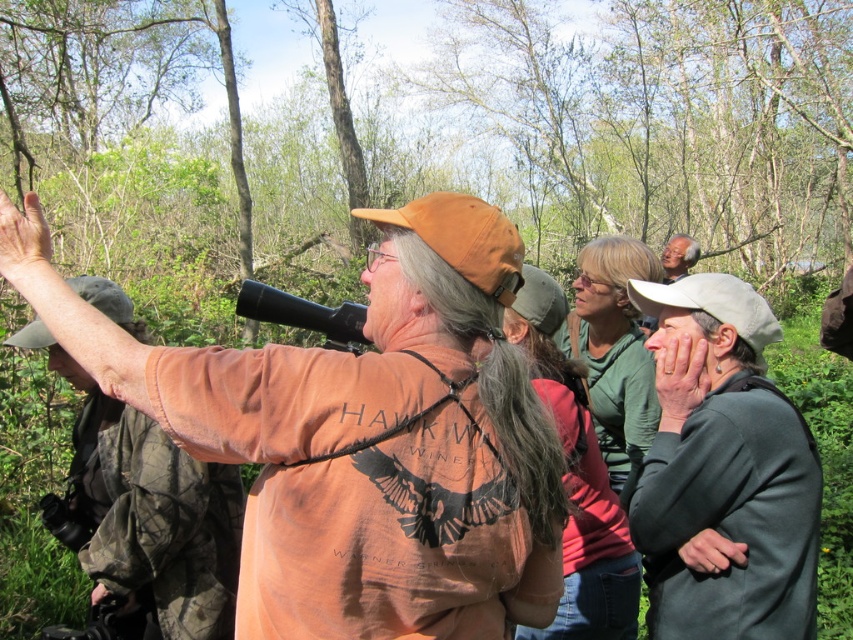
Question: Does orange fabric shirt at center appear on the right side of smooth brown hat at upper right?

Choices:
 (A) no
 (B) yes

Answer: (A)

Question: Is gray fabric jacket at right positioned before orange fabric shirt at upper left?

Choices:
 (A) no
 (B) yes

Answer: (B)

Question: Which point is closer to the camera taking this photo?

Choices:
 (A) (677, 253)
 (B) (317, 620)

Answer: (B)

Question: Based on their relative distances, which object is farther from the orange fabric shirt at upper left?

Choices:
 (A) gray fabric jacket at right
 (B) smooth brown hat at upper right
 (C) orange fabric shirt at center

Answer: (B)

Question: Is orange fabric shirt at upper left smaller than smooth brown hat at upper right?

Choices:
 (A) yes
 (B) no

Answer: (B)

Question: Which of the following is the closest to the observer?

Choices:
 (A) orange fabric shirt at upper left
 (B) gray fabric jacket at right

Answer: (B)